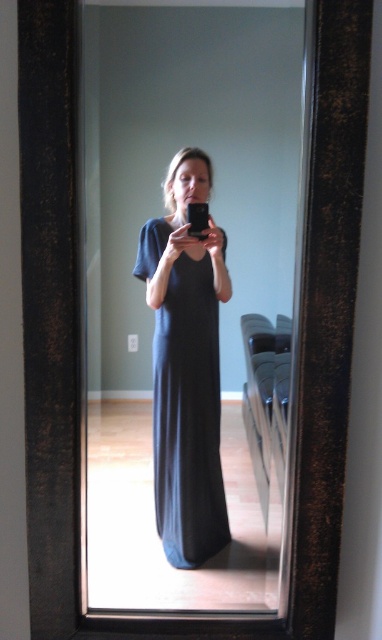
You are an interior designer planning to place a new sofa in this room. The sofa must be positioned so that it does not block the view of the black matte dress at center when standing at the mirror. Where should you place the sofa?

The sofa should be placed away from the line of sight between the mirror and the black matte dress at center to ensure the dress remains visible in the reflection.

You are standing in the room and want to check if you can reach the black matte dress at center without moving closer. Your outstretched hand can reach up to 1.1 meters. Can you touch it?

The black matte dress at center is 1.03 meters away from the viewer. Since your reach is 1.1 meters, you can touch it without moving closer.

You are standing in the room and want to place a small decorative item between the two points, point [215,582] and point [220,492]. Which point should you place it closer to in order to make it appear larger in the mirror?

You should place the decorative item closer to point [215,582] because it is closer to the viewer, so objects placed there will appear larger in the mirror compared to those closer to point [220,492].